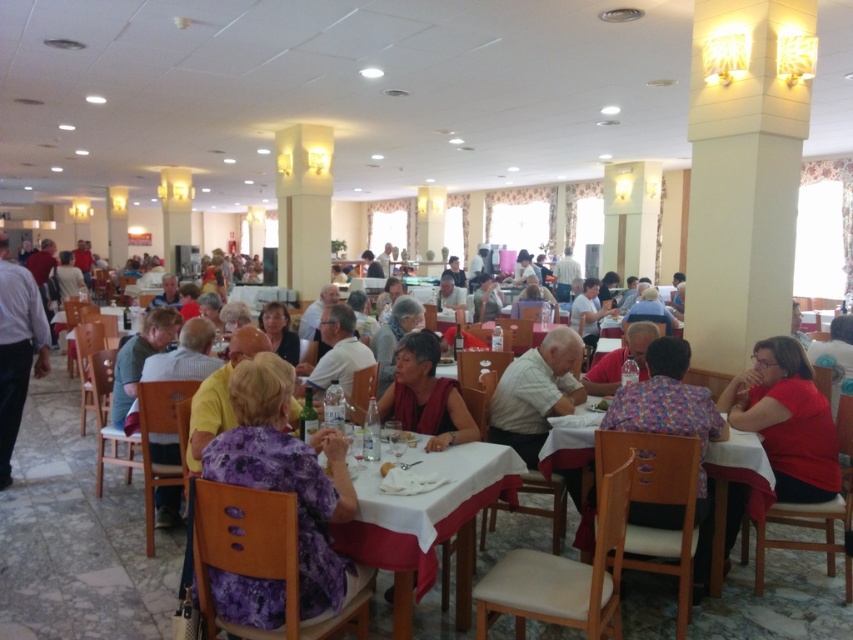
Question: Does light blue shirt at left have a lesser width compared to matte white shirt at center?

Choices:
 (A) no
 (B) yes

Answer: (A)

Question: Among these objects, which one is nearest to the camera?

Choices:
 (A) matte white shirt at center
 (B) white wood table at center
 (C) purple floral dress at center

Answer: (C)

Question: Does purple floral dress at center appear over matte red shirt at lower right?

Choices:
 (A) no
 (B) yes

Answer: (B)

Question: Does white wood table at center appear over matte white shirt at center?

Choices:
 (A) no
 (B) yes

Answer: (A)

Question: Estimate the real-world distances between objects in this image. Which object is farther from the white cloth table at center?

Choices:
 (A) matte red shirt at lower right
 (B) purple floral dress at center
 (C) white wood table at center

Answer: (A)

Question: Which of these objects is positioned closest to the floral fabric shirt at right?

Choices:
 (A) purple floral dress at center
 (B) matte white shirt at center
 (C) white wood table at center

Answer: (C)